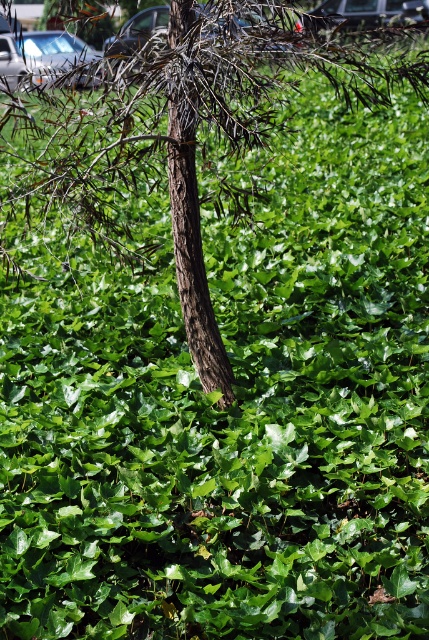
Does brown rough bark tree at center have a larger size compared to metallic silver car at upper center?

Actually, brown rough bark tree at center might be smaller than metallic silver car at upper center.

Which is above, brown rough bark tree at center or metallic silver car at upper center?

metallic silver car at upper center is above.

You are a GUI agent. You are given a task and a screenshot of the screen. Output one action in this format:
    pyautogui.click(x=<x>, y=<y>)
    Task: Click on the brown rough bark tree at center
    
    Given the screenshot: What is the action you would take?
    pyautogui.click(x=193, y=253)

The height and width of the screenshot is (640, 429). What do you see at coordinates (193, 253) in the screenshot? I see `brown rough bark tree at center` at bounding box center [193, 253].

Measure the distance between brown rough bark tree at center and camera.

A distance of 2.65 meters exists between brown rough bark tree at center and camera.

At what (x,y) coordinates should I click in order to perform the action: click on brown rough bark tree at center. Please return your answer as a coordinate pair (x, y). This screenshot has height=640, width=429. Looking at the image, I should click on (193, 253).

Between metallic silver car at upper left and metallic silver car at upper center, which one is positioned higher?

metallic silver car at upper center is higher up.

Which is in front, point (82, 84) or point (323, 12)?

Positioned in front is point (82, 84).

Where is `metallic silver car at upper left`? The image size is (429, 640). metallic silver car at upper left is located at coordinates (45, 58).